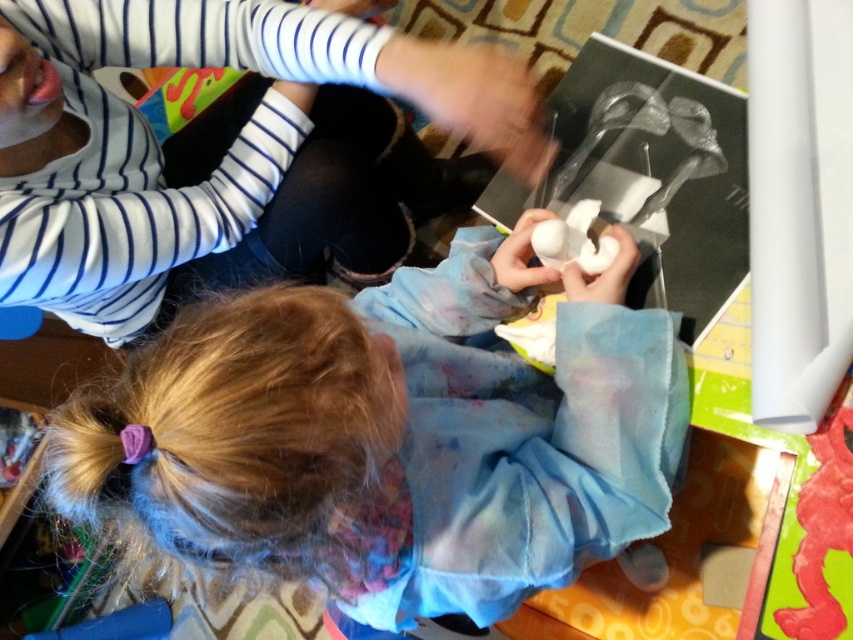
You are an observer looking at the scene. There is a white fabric at center and a white matte shirt at upper left. Which object is nearer to you?

The white fabric at center is closer to the viewer than the white matte shirt at upper left.

You are an observer looking at two white items in the image. The white fabric at center and the white matte shirt at upper left. Which one is positioned lower in the scene?

The white fabric at center is located below the white matte shirt at upper left, so it is positioned lower in the scene.